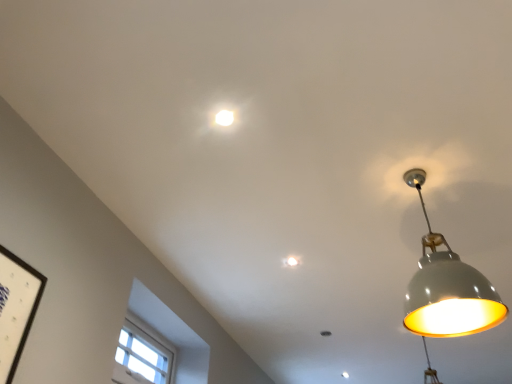
Question: From their relative heights in the image, would you say matte gray lampshade at right, which is the 2th lamp from back to front, is taller or shorter than white glossy light fixture at upper center, which appears as the 2th lamp when viewed from the right?

Choices:
 (A) tall
 (B) short

Answer: (A)

Question: From the image's perspective, relative to white glossy light fixture at upper center, which appears as the 2th lamp when viewed from the right, is matte gray lampshade at right, positioned as the first lamp in bottom-to-top order, above or below?

Choices:
 (A) below
 (B) above

Answer: (A)

Question: Considering the real-world distances, which object is closest to the white glossy light fixture at upper center, which appears as the 2th lamp when viewed from the right?

Choices:
 (A) matte gray lampshade at right, which ranks as the 1th lamp in right-to-left order
 (B) white wooden window at lower left

Answer: (A)

Question: Which is farther from the white glossy light fixture at upper center, the first lamp viewed from the top?

Choices:
 (A) matte gray lampshade at right, positioned as the first lamp in bottom-to-top order
 (B) white wooden window at lower left

Answer: (B)